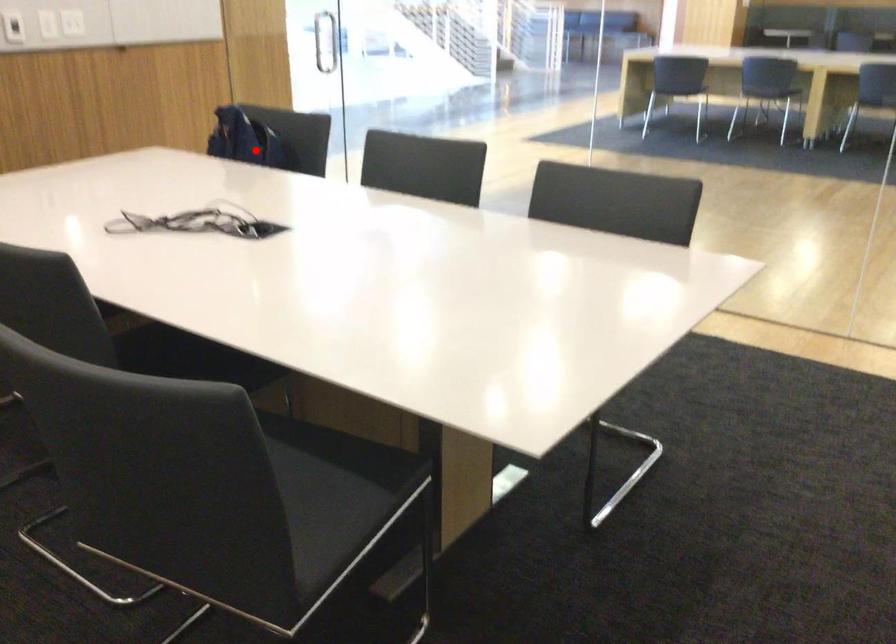
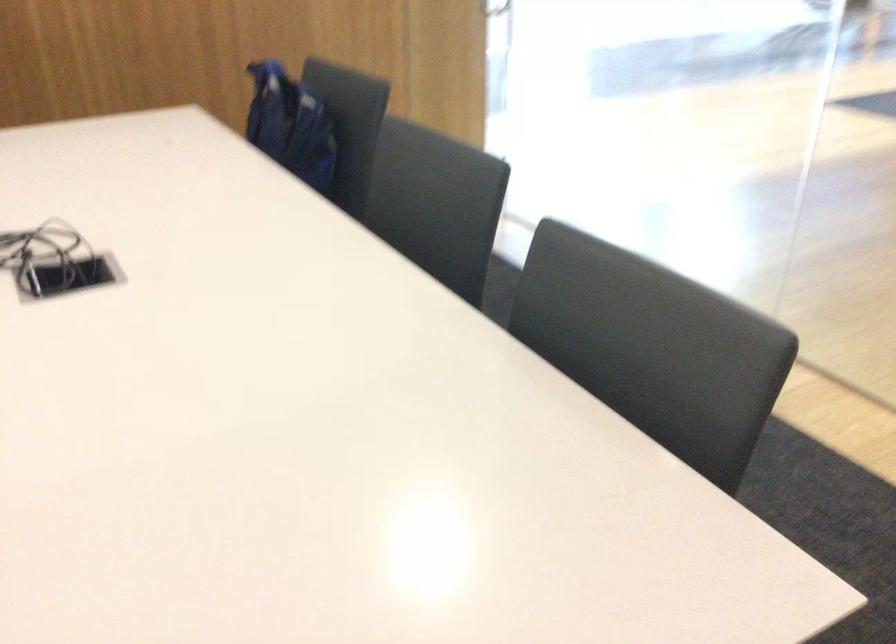
Locate, in the second image, the point that corresponds to the highlighted location in the first image.

(289, 125)